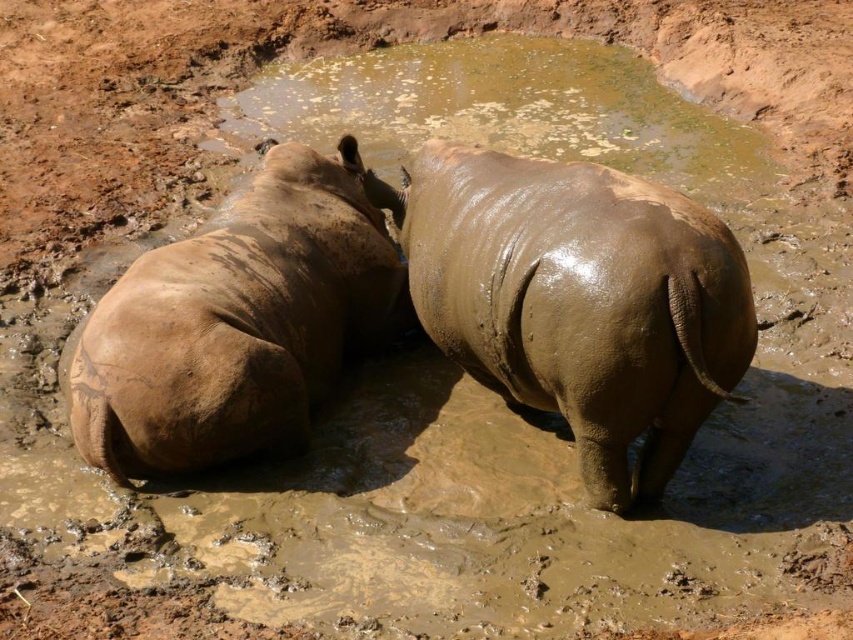
Does muddy wet rhinoceros at center have a greater height compared to muddy skin rhinoceros at left?

No.

Who is positioned more to the left, muddy wet rhinoceros at center or muddy skin rhinoceros at left?

muddy skin rhinoceros at left

Between point (705, 259) and point (386, 230), which one is positioned behind?

The point (386, 230) is behind.

The width and height of the screenshot is (853, 640). I want to click on muddy wet rhinoceros at center, so click(x=578, y=300).